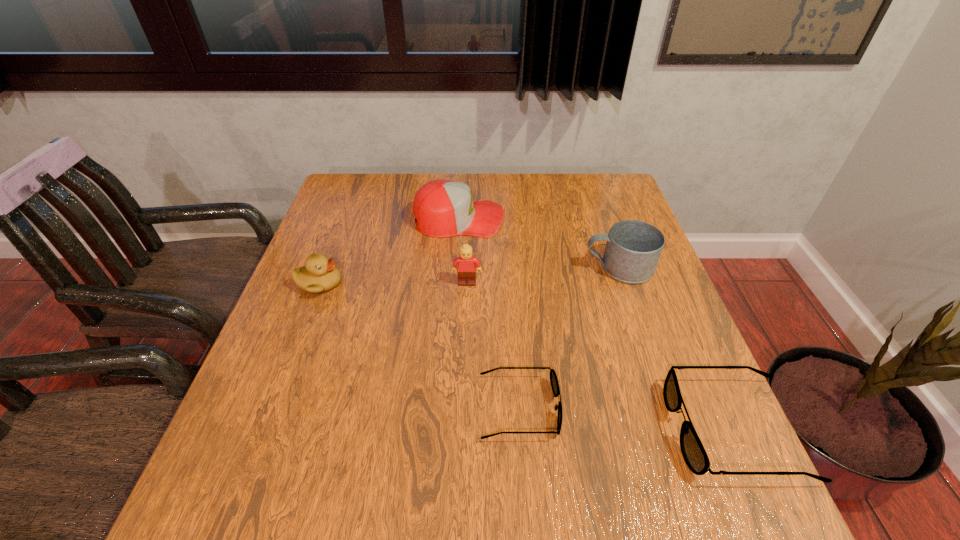
Find the location of a particular element. free space that satisfies the following two spatial constraints: 1. on the side of the mug with the handle; 2. on the face of the Lego is located at coordinates (624, 283).

At what (x,y) coordinates should I click in order to perform the action: click on free space that satisfies the following two spatial constraints: 1. on the face of the Lego; 2. at the beak of the duckling. Please return your answer as a coordinate pair (x, y). This screenshot has height=540, width=960. Looking at the image, I should click on (467, 284).